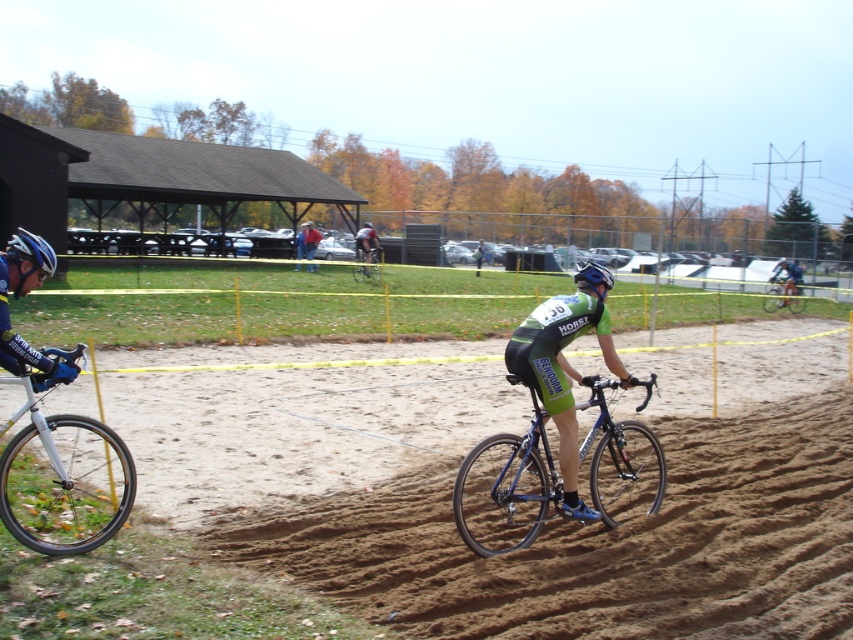
You are a GUI agent. You are given a task and a screenshot of the screen. Output one action in this format:
    pyautogui.click(x=<x>, y=<y>)
    Task: Click on the silver metallic bicycle wheel at left
    The width and height of the screenshot is (853, 640).
    Given the screenshot: What is the action you would take?
    pyautogui.click(x=62, y=477)

Which is in front, point (88, 467) or point (369, 227)?

Positioned in front is point (88, 467).

I want to click on silver metallic bicycle wheel at left, so click(62, 477).

Who is more forward, (169, 509) or (592, 260)?

Point (169, 509) is more forward.

Is point (119, 417) less distant than point (611, 282)?

No.

Is point (155, 392) positioned in front of point (601, 278)?

No, it is not.

The width and height of the screenshot is (853, 640). I want to click on brown sandy dirt at center, so click(297, 417).

Does shiny blue bike at center have a smaller size compared to blue metallic bicycle at center?

No, shiny blue bike at center is not smaller than blue metallic bicycle at center.

Does shiny blue bike at center appear on the left side of blue metallic bicycle at center?

Indeed, shiny blue bike at center is positioned on the left side of blue metallic bicycle at center.

Is point (613, 506) positioned after point (788, 291)?

That is False.

At what (x,y) coordinates should I click in order to perform the action: click on shiny blue bike at center. Please return your answer as a coordinate pair (x, y). Looking at the image, I should click on (505, 490).